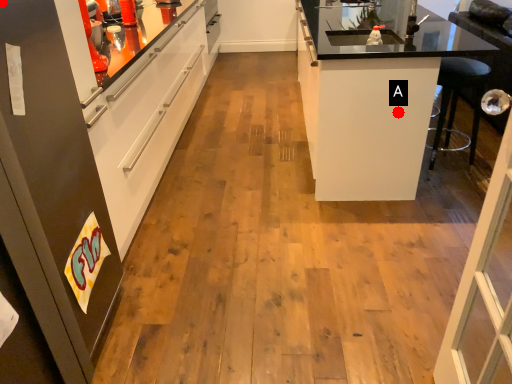
Question: Two points are circled on the image, labeled by A and B beside each circle. Which point is farther from the camera taking this photo?

Choices:
 (A) A is further
 (B) B is further

Answer: (A)